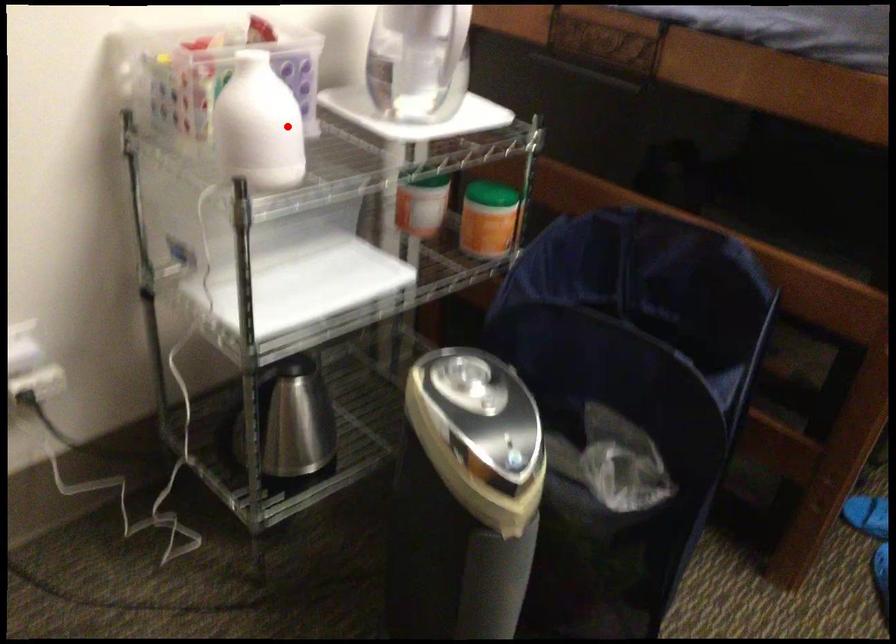
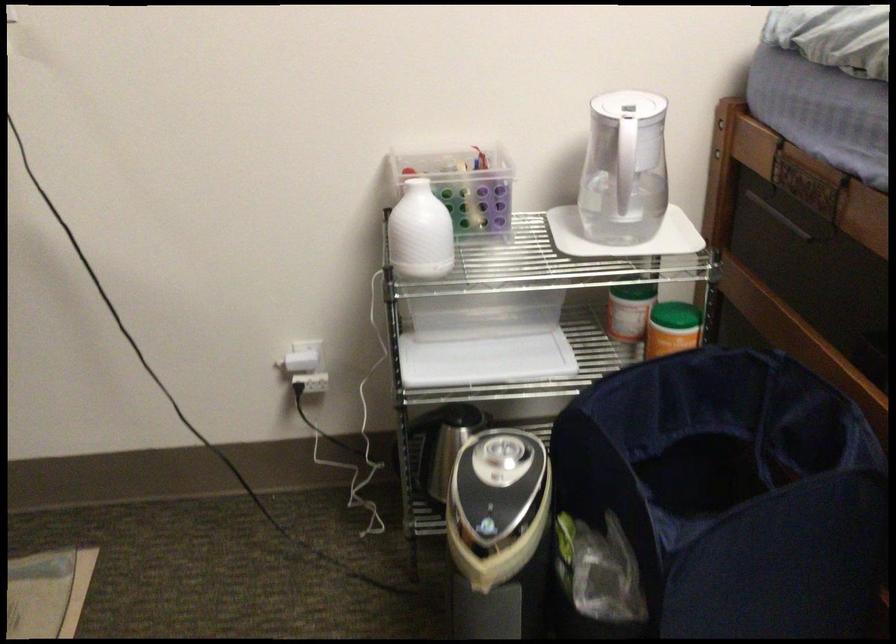
Question: I am providing you with two images of the same scene from different viewpoints. In image1, a red point is highlighted. Considering the same 3D point in image2, which of the following is correct?

Choices:
 (A) It is closer
 (B) It is farther

Answer: (B)